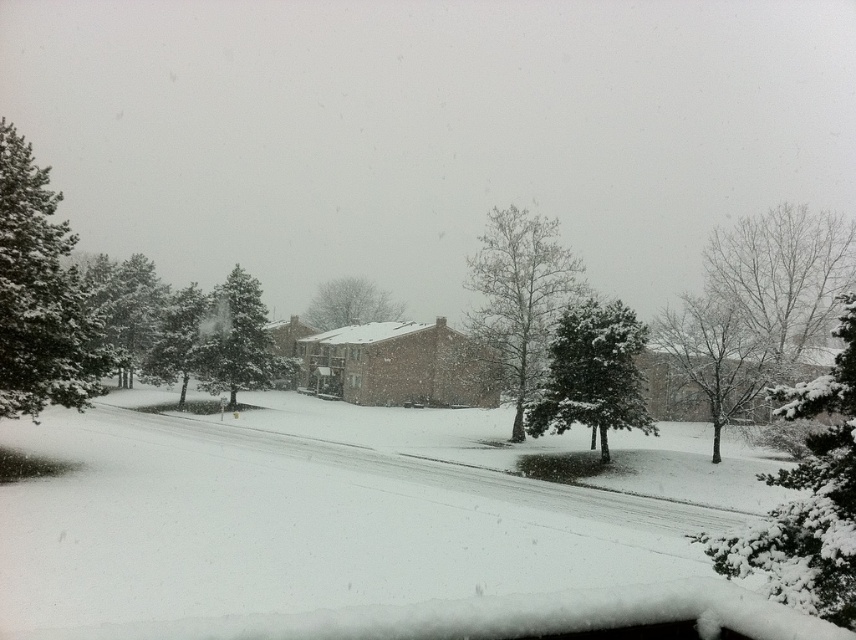
Question: Which point appears farthest from the camera in this image?

Choices:
 (A) (163, 317)
 (B) (633, 412)
 (C) (360, 298)

Answer: (C)

Question: Estimate the real-world distances between objects in this image. Which object is closer to the snow-covered tree at center?

Choices:
 (A) snow-covered evergreen at center
 (B) white fluffy tree at right

Answer: (A)

Question: Does snow-covered tree at center-right have a lesser width compared to snow-covered evergreen at left?

Choices:
 (A) no
 (B) yes

Answer: (B)

Question: Which object is the closest to the snow-covered evergreen at left?

Choices:
 (A) snow-covered pine tree at left
 (B) green matte tree at center
 (C) snow-covered tree at center

Answer: (A)

Question: Is white fluffy tree at right to the right of snow-covered tree at center-right from the viewer's perspective?

Choices:
 (A) no
 (B) yes

Answer: (A)

Question: Can you confirm if white fluffy tree at right is positioned to the left of green matte tree at left?

Choices:
 (A) no
 (B) yes

Answer: (A)